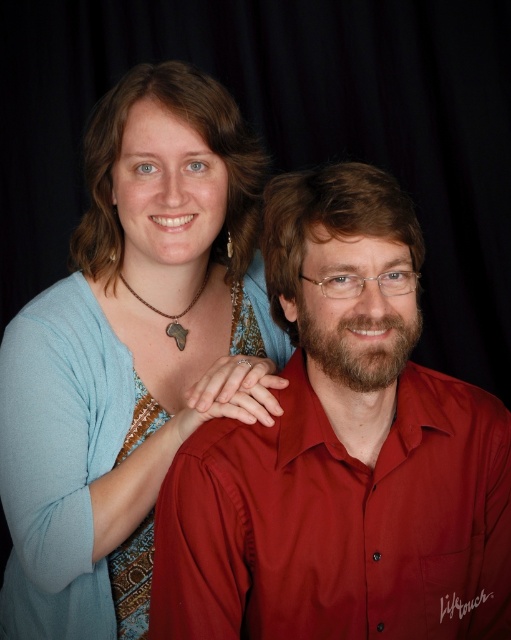
Question: Which of the following is the closest to the observer?

Choices:
 (A) matte red shirt at center
 (B) matte blue sweater at upper left

Answer: (A)

Question: Is matte red shirt at center below matte blue sweater at upper left?

Choices:
 (A) yes
 (B) no

Answer: (A)

Question: Does matte red shirt at center come in front of matte blue sweater at upper left?

Choices:
 (A) yes
 (B) no

Answer: (A)

Question: Observing the image, what is the correct spatial positioning of matte red shirt at center in reference to matte blue sweater at upper left?

Choices:
 (A) above
 (B) below

Answer: (B)